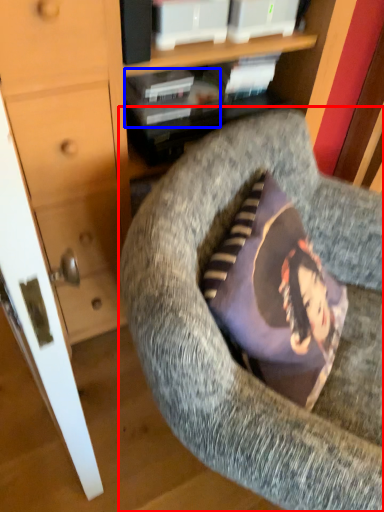
Question: Which object is closer to the camera taking this photo, chair (highlighted by a red box) or book (highlighted by a blue box)?

Choices:
 (A) chair
 (B) book

Answer: (A)